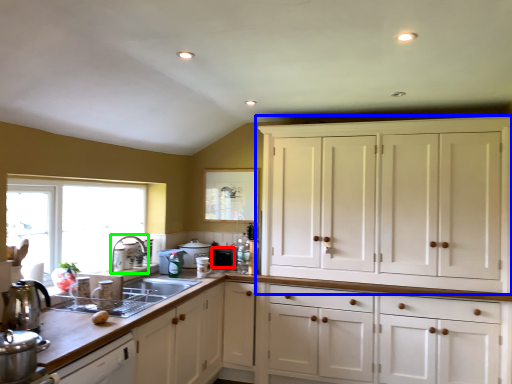
Question: Which is nearer to the appliance (highlighted by a red box)? cabinetry (highlighted by a blue box) or faucet (highlighted by a green box).

Choices:
 (A) cabinetry
 (B) faucet

Answer: (B)